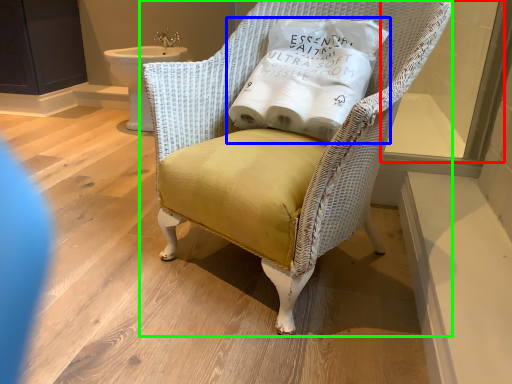
Question: Based on their relative distances, which object is farther from window (highlighted by a red box)? Choose from pillow (highlighted by a blue box) and chair (highlighted by a green box).

Choices:
 (A) pillow
 (B) chair

Answer: (B)